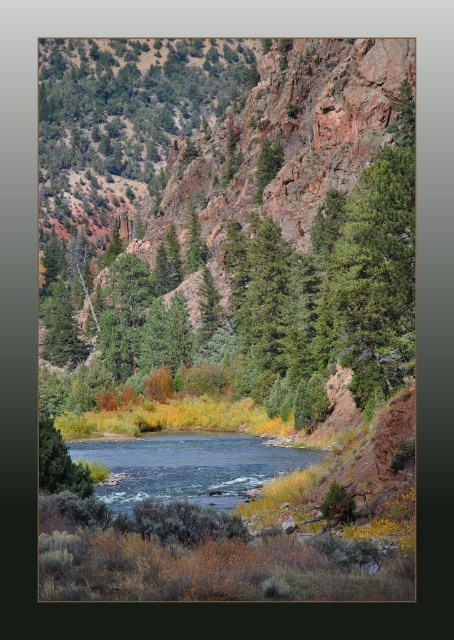
Between green coniferous trees at center and greenish-blue water at center, which one is positioned lower?

greenish-blue water at center is below.

Is green coniferous trees at center to the right of greenish-blue water at center from the viewer's perspective?

In fact, green coniferous trees at center is to the left of greenish-blue water at center.

This screenshot has height=640, width=454. I want to click on green coniferous trees at center, so click(x=252, y=243).